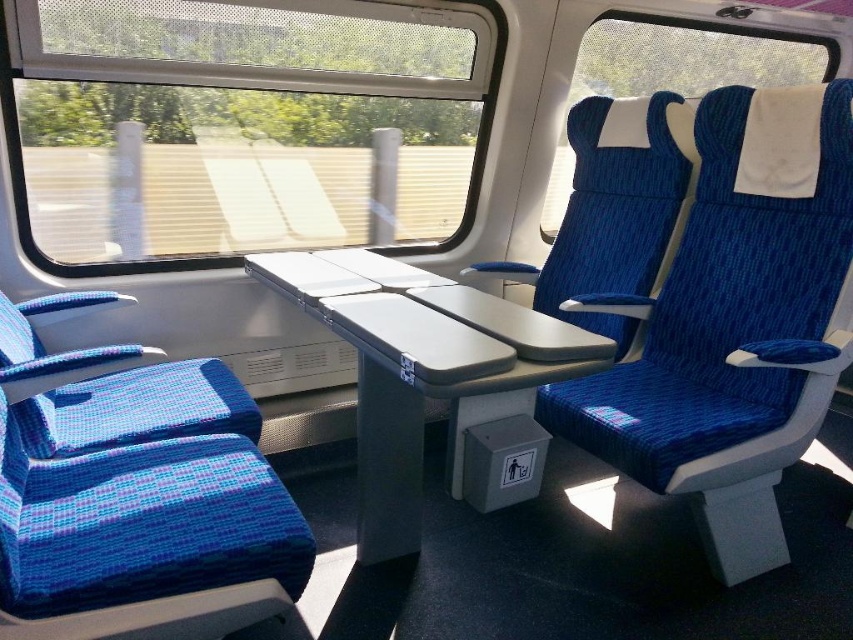
Question: Which point appears closest to the camera in this image?

Choices:
 (A) (292, 257)
 (B) (117, 435)
 (C) (758, 35)
 (D) (579, 104)

Answer: (B)

Question: Among these objects, which one is nearest to the camera?

Choices:
 (A) gray matte table at center
 (B) blue textured fabric seat at lower left

Answer: (A)

Question: Considering the real-world distances, which object is farthest from the transparent glass window at upper center?

Choices:
 (A) gray matte table at center
 (B) blue fabric chair at center
 (C) blue fabric window at upper center

Answer: (C)

Question: Does blue textured fabric seat at left lie in front of gray matte table at center?

Choices:
 (A) yes
 (B) no

Answer: (A)

Question: Does gray matte table at center have a greater width compared to blue fabric window at upper center?

Choices:
 (A) no
 (B) yes

Answer: (A)

Question: Is blue fabric seat at center wider than blue textured fabric seat at left?

Choices:
 (A) no
 (B) yes

Answer: (A)